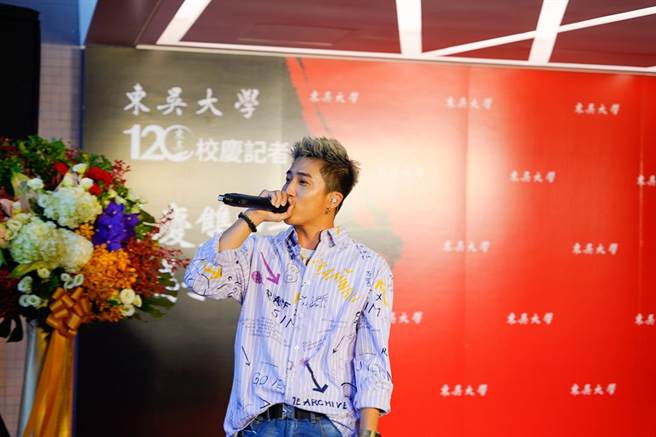
Find the location of `ceiling`. ceiling is located at coordinates (321, 20).